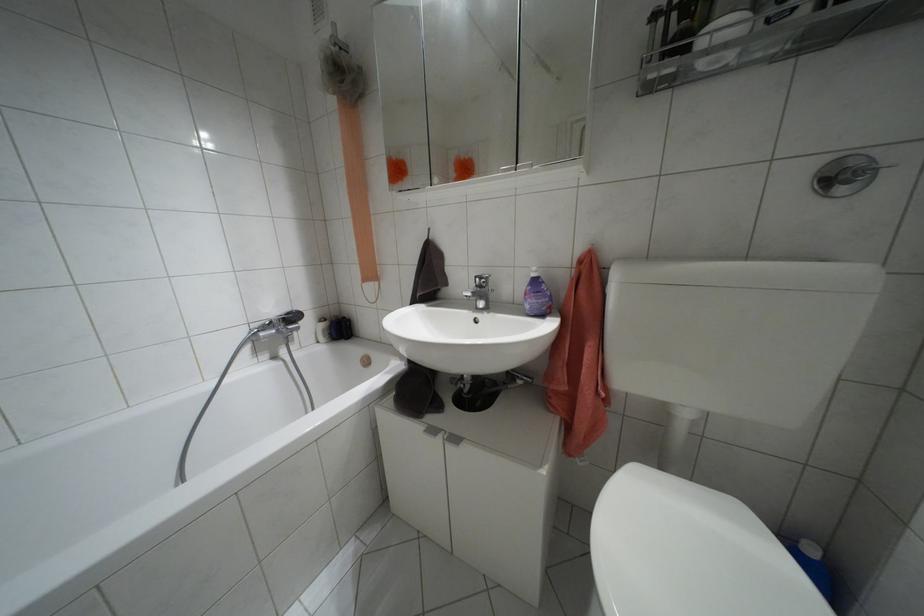
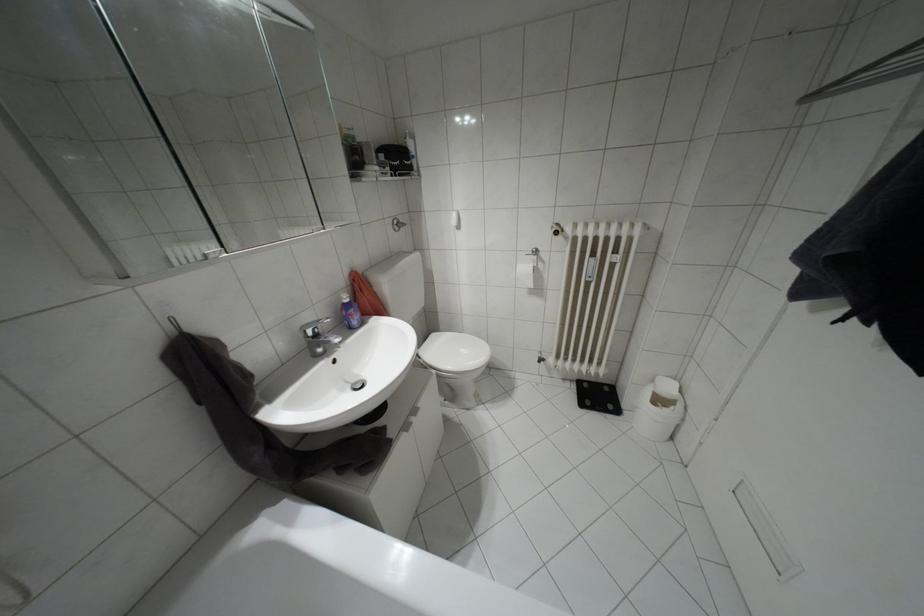
Find the pixel in the second image that matches [532,274] in the first image.

(346, 300)